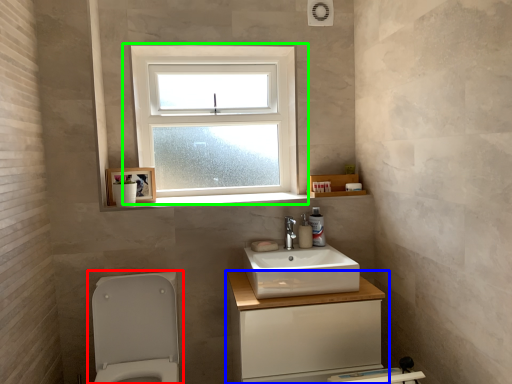
Question: Estimate the real-world distances between objects in this image. Which object is closer to toilet (highlighted by a red box), bathroom cabinet (highlighted by a blue box) or window (highlighted by a green box)?

Choices:
 (A) bathroom cabinet
 (B) window

Answer: (A)